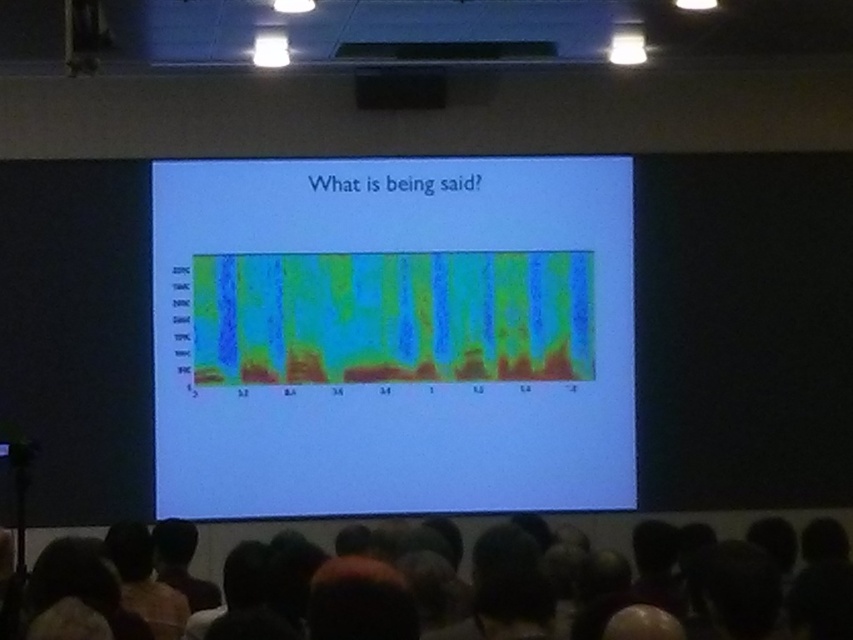
Can you confirm if green gradient heatmap at center is positioned to the left of dark hair at lower center?

No, green gradient heatmap at center is not to the left of dark hair at lower center.

Who is more forward, (497, 436) or (202, 538)?

Positioned in front is point (202, 538).

What do you see at coordinates (392, 336) in the screenshot? The image size is (853, 640). I see `green gradient heatmap at center` at bounding box center [392, 336].

The height and width of the screenshot is (640, 853). Find the location of `green gradient heatmap at center`. green gradient heatmap at center is located at coordinates (392, 336).

Is dark hair at lower center wider than black matte speaker at upper center?

Incorrect, dark hair at lower center's width does not surpass black matte speaker at upper center's.

Does dark hair at lower center have a lesser height compared to black matte speaker at upper center?

No, dark hair at lower center is not shorter than black matte speaker at upper center.

Identify the location of dark hair at lower center. This screenshot has width=853, height=640. (689, 522).

The height and width of the screenshot is (640, 853). In order to click on dark hair at lower center in this screenshot , I will do `click(689, 522)`.

Is point (173, 164) farther from camera compared to point (440, 104)?

No, it is not.

Is point (582, 225) positioned before point (358, 86)?

No, it is not.

You are a GUI agent. You are given a task and a screenshot of the screen. Output one action in this format:
    pyautogui.click(x=<x>, y=<y>)
    Task: Click on the green gradient heatmap at center
    The width and height of the screenshot is (853, 640).
    Given the screenshot: What is the action you would take?
    tap(392, 336)